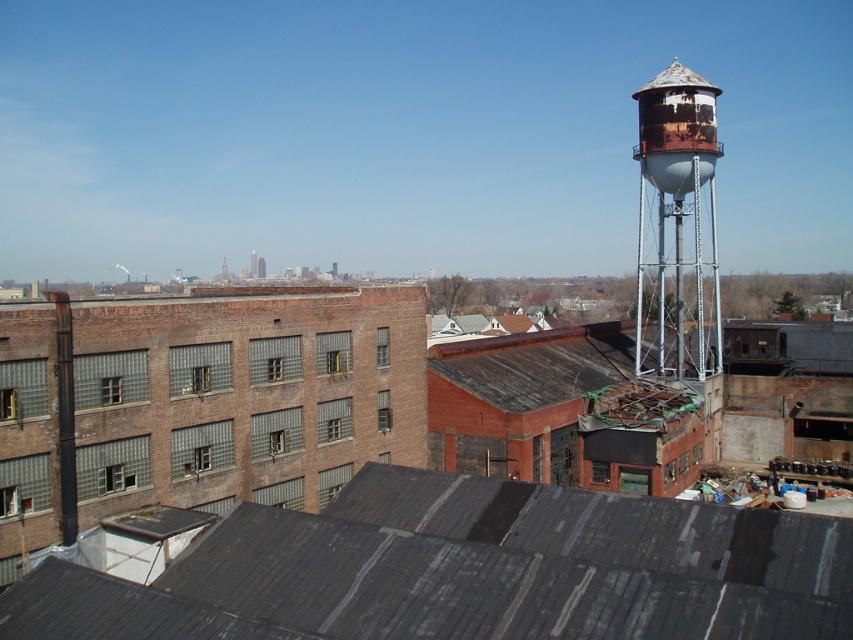
Question: From the image, what is the correct spatial relationship of dark gray corrugated metal roof at center in relation to rusty metal water tower at upper right?

Choices:
 (A) above
 (B) below

Answer: (B)

Question: Among these objects, which one is farthest from the camera?

Choices:
 (A) dark gray corrugated metal roof at center
 (B) rusty metal water tower at upper right

Answer: (B)

Question: Which point is closer to the camera?

Choices:
 (A) rusty metal water tower at upper right
 (B) dark gray corrugated metal roof at center

Answer: (B)

Question: Is dark gray corrugated metal roof at center smaller than rusty metal water tower at upper right?

Choices:
 (A) no
 (B) yes

Answer: (B)

Question: Is dark gray corrugated metal roof at center to the right of rusty metal water tower at upper right from the viewer's perspective?

Choices:
 (A) no
 (B) yes

Answer: (A)